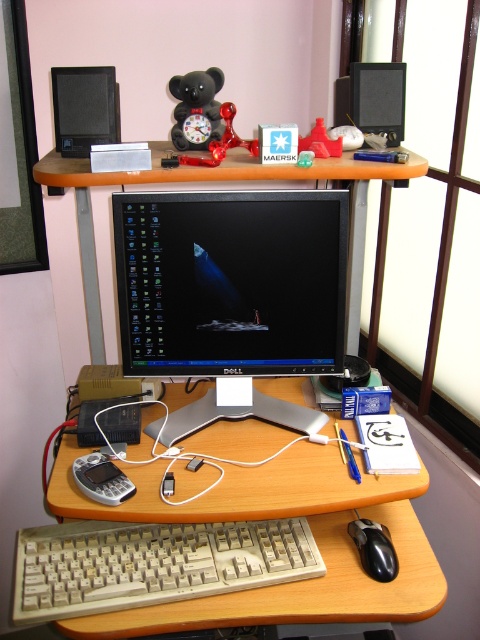
Does black glossy monitor at center appear on the right side of black matte bear at upper center?

Yes, black glossy monitor at center is to the right of black matte bear at upper center.

Can you confirm if black glossy monitor at center is bigger than black matte bear at upper center?

Yes.

Which is in front, point (315, 204) or point (215, 67)?

Point (315, 204)

This screenshot has height=640, width=480. I want to click on black glossy monitor at center, so click(x=231, y=296).

Who is more distant from viewer, (180, 545) or (384, 177)?

Positioned behind is point (384, 177).

Is beige plastic keyboard at lower center below wooden desk at center?

Yes.

Is point (46, 564) less distant than point (355, 205)?

Yes, it is.

I want to click on beige plastic keyboard at lower center, so click(x=153, y=563).

Can you confirm if beige plastic keyboard at lower center is thinner than translucent plastic bear at upper center?

In fact, beige plastic keyboard at lower center might be wider than translucent plastic bear at upper center.

Is point (17, 560) positioned before point (324, 150)?

Yes, it is in front of point (324, 150).

Where is `beige plastic keyboard at lower center`? The image size is (480, 640). beige plastic keyboard at lower center is located at coordinates (153, 563).